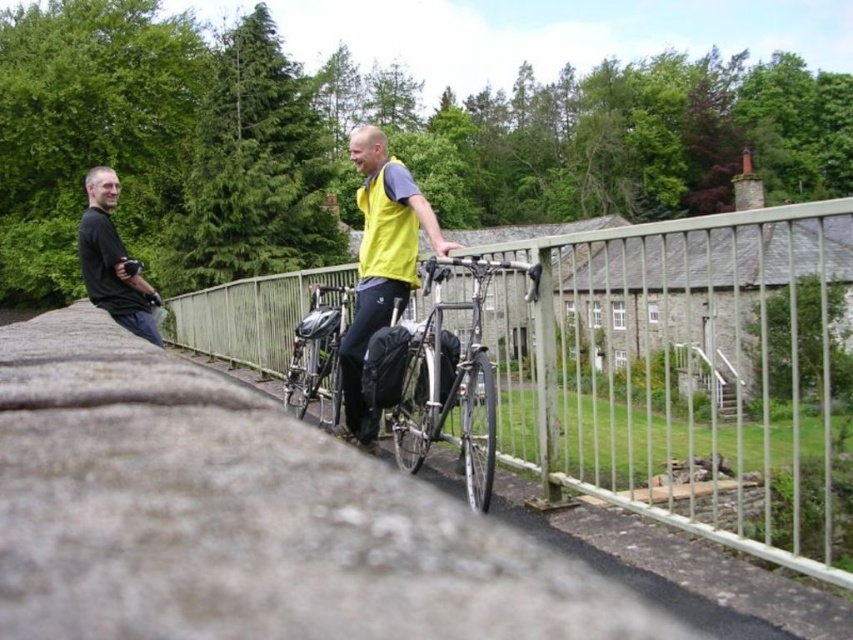
Is shiny metallic bicycle at center in front of matte black camera at left?

Yes.

Can you confirm if shiny metallic bicycle at center is positioned to the right of matte black camera at left?

Indeed, shiny metallic bicycle at center is positioned on the right side of matte black camera at left.

Find the location of `shiny metallic bicycle at center`. shiny metallic bicycle at center is located at coordinates (451, 378).

The width and height of the screenshot is (853, 640). What are the coordinates of `shiny metallic bicycle at center` in the screenshot? It's located at (451, 378).

Is shiny metallic bicycle at center to the right of yellow fabric vest at center from the viewer's perspective?

Yes, shiny metallic bicycle at center is to the right of yellow fabric vest at center.

Find the location of `shiny metallic bicycle at center`. shiny metallic bicycle at center is located at coordinates (451, 378).

Describe the element at coordinates (451, 378) in the screenshot. Image resolution: width=853 pixels, height=640 pixels. I see `shiny metallic bicycle at center` at that location.

Where is `shiny metallic bicycle at center`? shiny metallic bicycle at center is located at coordinates (451, 378).

Does point (679, 360) come farther from viewer compared to point (480, 333)?

Yes.

At what (x,y) coordinates should I click in order to perform the action: click on metallic silver fence at center. Please return your answer as a coordinate pair (x, y). This screenshot has width=853, height=640. Looking at the image, I should click on (685, 372).